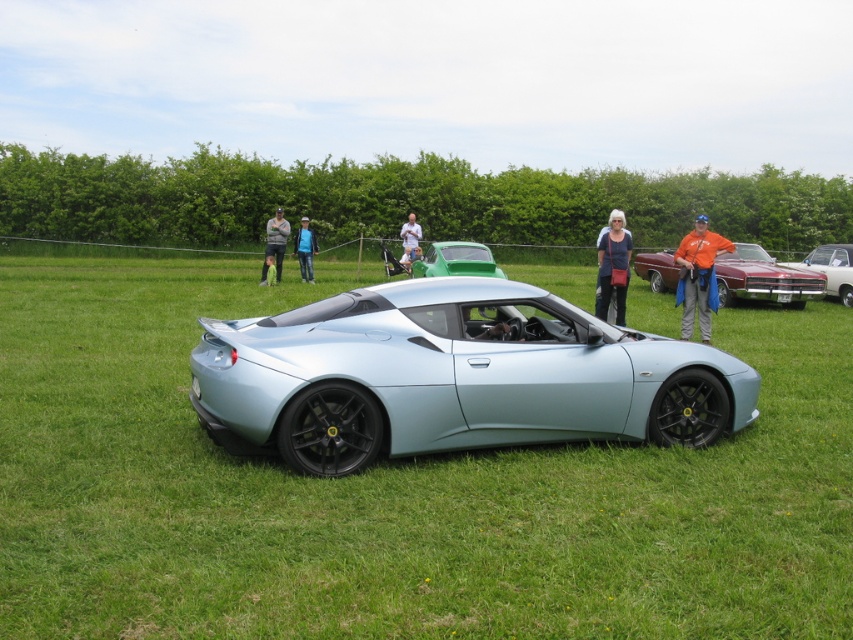
You are standing at the point marked by the coordinates point (276, 237) in the image. What item is located at this position?

The point (276, 237) corresponds to the denim jacket at center.